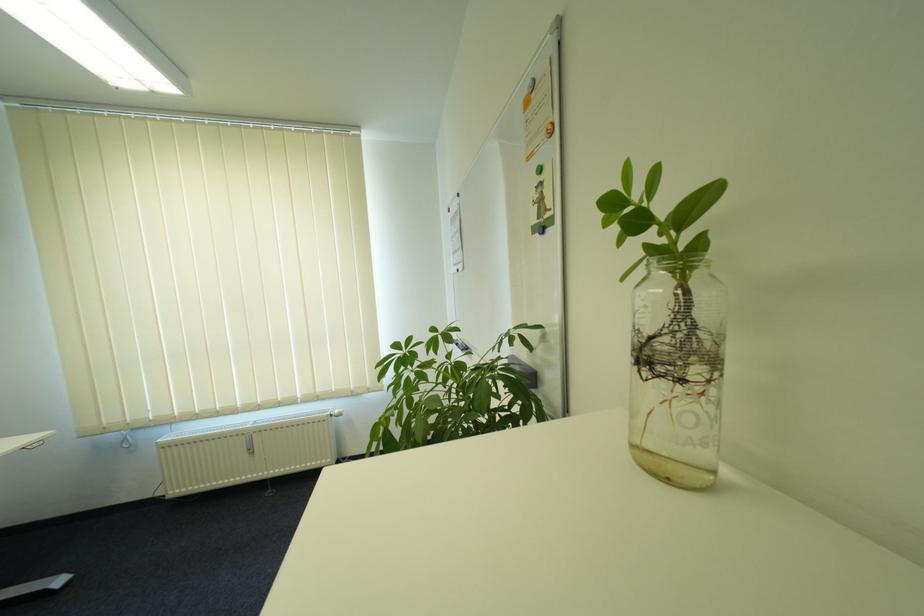
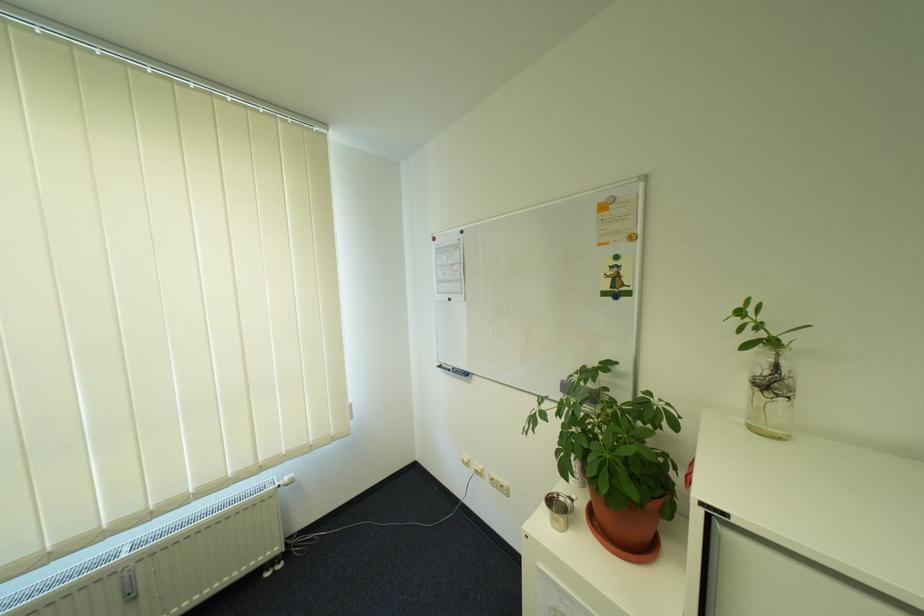
In the second image, find the point that corresponds to the point at 458,211 in the first image.

(444, 240)